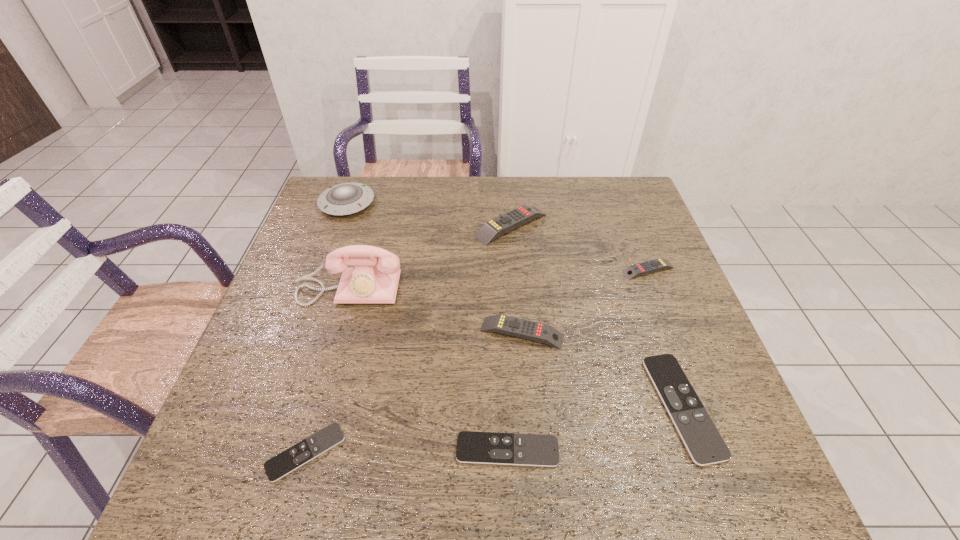
The width and height of the screenshot is (960, 540). In order to click on the tallest object in this screenshot , I will do `click(370, 280)`.

This screenshot has height=540, width=960. I want to click on telephone, so click(370, 280).

Find the location of a particular element. This screenshot has height=540, width=960. the seventh shortest object is located at coordinates (346, 198).

This screenshot has height=540, width=960. Find the location of `the tallest remote control`. the tallest remote control is located at coordinates (500, 225).

Locate an element on the screen. This screenshot has height=540, width=960. the farthest remote control is located at coordinates (500, 225).

You are a GUI agent. You are given a task and a screenshot of the screen. Output one action in this format:
    pyautogui.click(x=<x>, y=<y>)
    Task: Click on the fourth tallest object
    Image resolution: width=960 pixels, height=540 pixels.
    Given the screenshot: What is the action you would take?
    pyautogui.click(x=521, y=328)

Image resolution: width=960 pixels, height=540 pixels. I want to click on the fourth nearest object, so click(x=521, y=328).

Image resolution: width=960 pixels, height=540 pixels. In order to click on the rightmost yellow remote control in this screenshot , I will do `click(631, 272)`.

At what (x,y) coordinates should I click in order to perform the action: click on the fifth nearest remote control. Please return your answer as a coordinate pair (x, y). This screenshot has width=960, height=540. Looking at the image, I should click on pyautogui.click(x=631, y=272).

The height and width of the screenshot is (540, 960). What are the coordinates of `the third shortest object` in the screenshot? It's located at (700, 436).